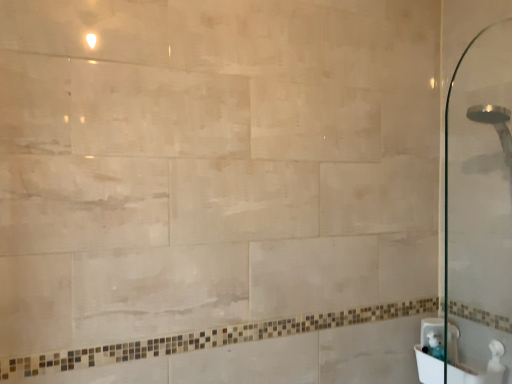
Question: Is white glossy sink at lower right, positioned as the 2th sink in back-to-front order, wider or thinner than white glossy sink at lower right, placed as the first sink when sorted from back to front?

Choices:
 (A) wide
 (B) thin

Answer: (A)

Question: Is point (496, 364) closer or farther from the camera than point (449, 337)?

Choices:
 (A) farther
 (B) closer

Answer: (B)

Question: Is white glossy sink at lower right, the 1th sink viewed from the front, bigger or smaller than white glossy sink at lower right, which is the second sink from front to back?

Choices:
 (A) small
 (B) big

Answer: (B)

Question: Considering the positions of white glossy sink at lower right, placed as the first sink when sorted from back to front, and white glossy sink at lower right, the 1th sink viewed from the front, in the image, is white glossy sink at lower right, placed as the first sink when sorted from back to front, wider or thinner than white glossy sink at lower right, the 1th sink viewed from the front,?

Choices:
 (A) thin
 (B) wide

Answer: (A)

Question: Considering the positions of point (431, 324) and point (468, 360), is point (431, 324) closer or farther from the camera than point (468, 360)?

Choices:
 (A) farther
 (B) closer

Answer: (A)

Question: In terms of size, does white glossy sink at lower right, placed as the first sink when sorted from back to front, appear bigger or smaller than white glossy sink at lower right, positioned as the 2th sink in back-to-front order?

Choices:
 (A) small
 (B) big

Answer: (A)

Question: From a real-world perspective, is white glossy sink at lower right, which is the second sink from front to back, positioned above or below white glossy sink at lower right, the 1th sink viewed from the front?

Choices:
 (A) above
 (B) below

Answer: (A)